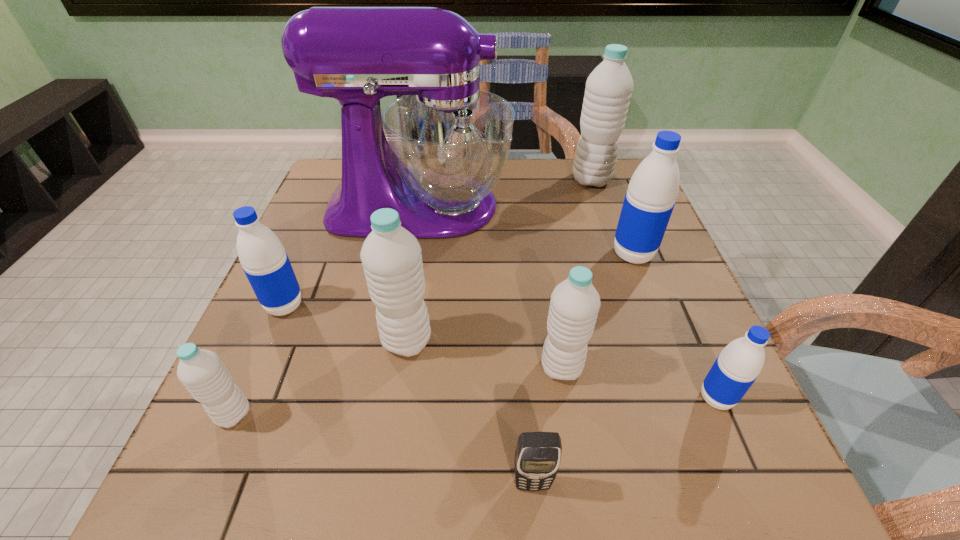
Locate an element on the screen. This screenshot has width=960, height=540. vacant space positioned 0.250m on the front of the second white water bottle from left to right is located at coordinates (382, 503).

Where is `vacant space located 0.300m on the back of the third biggest white water bottle`? This screenshot has height=540, width=960. vacant space located 0.300m on the back of the third biggest white water bottle is located at coordinates (542, 249).

The height and width of the screenshot is (540, 960). What are the coordinates of `blank space located 0.210m on the front of the second biggest blue water bottle` in the screenshot? It's located at pos(238,415).

Where is `free space located 0.330m on the back of the nearest blue water bottle`? free space located 0.330m on the back of the nearest blue water bottle is located at coordinates (657, 260).

Where is `free space located 0.340m on the right of the smallest white water bottle`? free space located 0.340m on the right of the smallest white water bottle is located at coordinates (451, 414).

You are a GUI agent. You are given a task and a screenshot of the screen. Output one action in this format:
    pyautogui.click(x=<x>, y=<y>)
    Task: Click on the mixer that is at the far edge
    This screenshot has height=540, width=960.
    Given the screenshot: What is the action you would take?
    (x=447, y=143)

Locate an element on the screen. The image size is (960, 540). water bottle that is at the far edge is located at coordinates (608, 90).

Identify the location of object at the near edge. (538, 454).

Identify the location of mixer that is positioned at the left edge. (447, 143).

This screenshot has height=540, width=960. I want to click on object that is at the far left corner, so click(x=447, y=143).